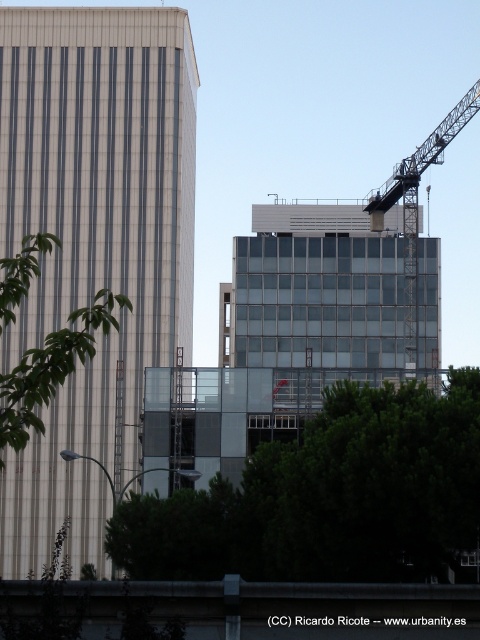
Does white glass building at left appear under green leafy tree at left?

Indeed, white glass building at left is positioned under green leafy tree at left.

The height and width of the screenshot is (640, 480). I want to click on white glass building at left, so click(94, 244).

Where is `white glass building at left`? white glass building at left is located at coordinates (94, 244).

Which of these two, green leafy tree at center or green leafy tree at left, stands taller?

green leafy tree at left is taller.

Is green leafy tree at center in front of green leafy tree at left?

No, it is not.

Between point (383, 440) and point (97, 291), which one is positioned behind?

The point (97, 291) is behind.

The width and height of the screenshot is (480, 640). I want to click on green leafy tree at center, so click(328, 497).

The height and width of the screenshot is (640, 480). What are the coordinates of `green leafy tree at center` in the screenshot? It's located at (328, 497).

Is green leafy tree at center closer to camera compared to metallic gray crane at upper right?

That is True.

Which is in front, point (475, 381) or point (415, 266)?

Positioned in front is point (475, 381).

Find the location of a particular element. The image size is (480, 640). green leafy tree at center is located at coordinates (328, 497).